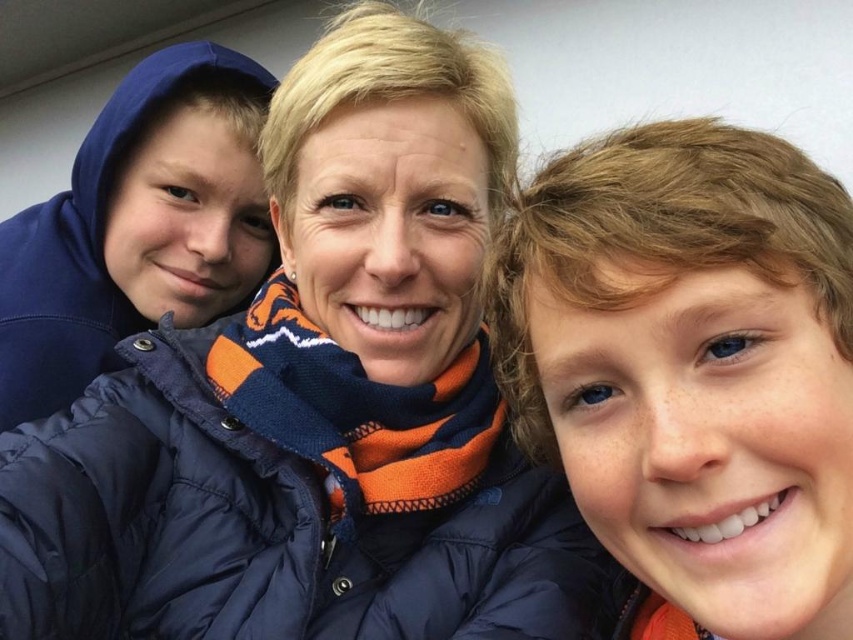
You are taking a selfie and want to ensure that the brown curly hair at upper right is visible in the photo. Based on the current composition, is the point at coordinates point [691,371] within the frame of the selfie?

The point at coordinates point [691,371] marks brown curly hair at upper right, so yes, the brown curly hair at upper right is visible within the frame of the selfie.

Looking at the selfie, can you tell whether the navy blue puffer jacket at center is positioned to the left or right of the brown curly hair at upper right?

The navy blue puffer jacket at center is positioned to the left of the brown curly hair at upper right.

You are trying to locate the navy blue puffer jacket at center in the image. Can you tell me the coordinates where it is located?

The navy blue puffer jacket at center is located at coordinates point (x=318, y=403).